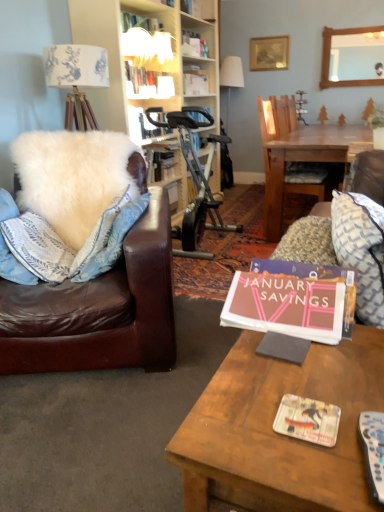
Question: Choose the correct answer: Is matte white book at upper center, arranged as the first book when viewed from the top, inside matte paper magazine at center or outside it?

Choices:
 (A) inside
 (B) outside

Answer: (B)

Question: From a real-world perspective, is matte white book at upper center, which is the 2th book from front to back, physically located above or below matte paper magazine at center?

Choices:
 (A) below
 (B) above

Answer: (B)

Question: Estimate the real-world distances between objects in this image. Which object is closer to the matte pink book at center, which is the 2th book in left-to-right order?

Choices:
 (A) matte paper magazine at center
 (B) white fluffy pillow at left, placed as the second pillow when sorted from right to left
 (C) wooden mirror at upper center
 (D) patterned fabric pillow at right, the 2th pillow in the left-to-right sequence
 (E) wooden chair at center

Answer: (D)

Question: Which of these objects is positioned farthest from the wooden mirror at upper center?

Choices:
 (A) wooden picture frame at upper center
 (B) matte white book at upper center, placed as the 1th book when sorted from left to right
 (C) patterned fabric pillow at right, the first pillow when ordered from right to left
 (D) wooden table at center
 (E) wooden chair at center

Answer: (D)